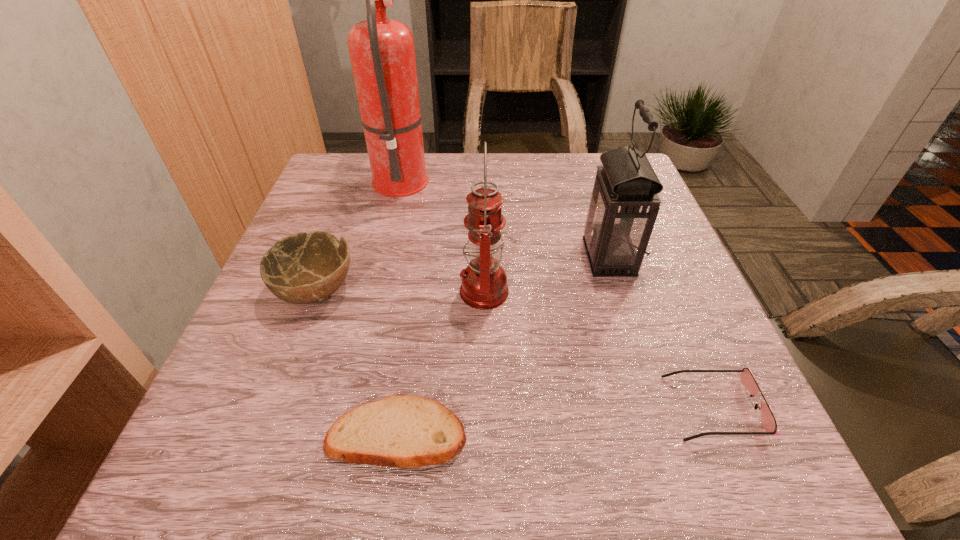
The height and width of the screenshot is (540, 960). I want to click on free space located 0.280m on the front-facing side of the lantern, so click(451, 257).

Locate an element on the screen. The image size is (960, 540). vacant area situated on the left of the oil lamp is located at coordinates (323, 291).

The image size is (960, 540). Identify the location of vacant area located 0.210m on the right of the third shortest object. (464, 291).

Where is `vacant area situated 0.200m on the bridge of the sunglasses`? The width and height of the screenshot is (960, 540). vacant area situated 0.200m on the bridge of the sunglasses is located at coordinates (542, 408).

You are a GUI agent. You are given a task and a screenshot of the screen. Output one action in this format:
    pyautogui.click(x=<x>, y=<y>)
    Task: Click on the vacant space located 0.120m on the bridge of the sunglasses
    Image resolution: width=960 pixels, height=540 pixels.
    Given the screenshot: What is the action you would take?
    pyautogui.click(x=593, y=408)

Locate an element on the screen. This screenshot has width=960, height=540. vacant space situated on the bridge of the sunglasses is located at coordinates (581, 408).

The width and height of the screenshot is (960, 540). Identify the location of free space located on the back of the pita bread. (420, 267).

You are a GUI agent. You are given a task and a screenshot of the screen. Output one action in this format:
    pyautogui.click(x=<x>, y=<y>)
    Task: Click on the object that is at the far edge
    
    Given the screenshot: What is the action you would take?
    pyautogui.click(x=382, y=53)

Where is `sunglasses present at the near edge`? sunglasses present at the near edge is located at coordinates (768, 423).

The height and width of the screenshot is (540, 960). Find the location of `pita bread that is at the near edge`. pita bread that is at the near edge is located at coordinates tap(403, 431).